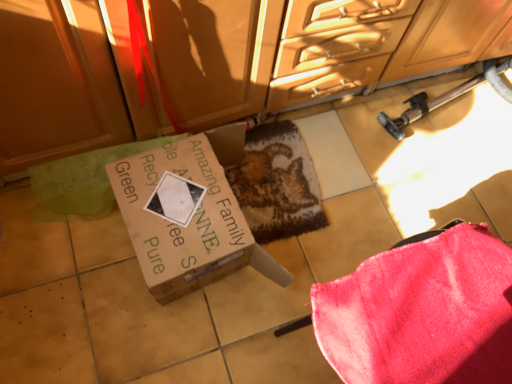
Locate an element on the screen. The width and height of the screenshot is (512, 384). free spot below textured brown mat at center (from a real-world perspective) is located at coordinates tap(279, 176).